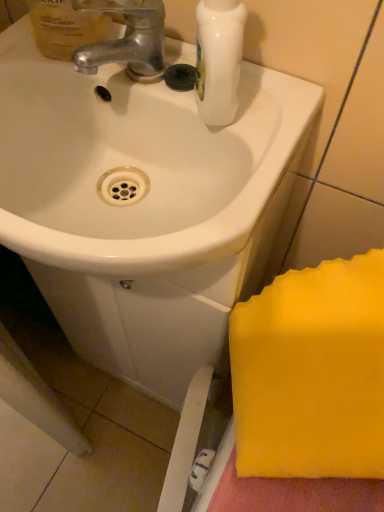
Question: Considering their positions, is silver metallic faucet at upper left located in front of or behind white glossy sink at center?

Choices:
 (A) front
 (B) behind

Answer: (B)

Question: Would you say silver metallic faucet at upper left is inside or outside white glossy sink at center?

Choices:
 (A) outside
 (B) inside

Answer: (A)

Question: Estimate the real-world distances between objects in this image. Which object is farther from the translucent plastic mouthwash at upper left?

Choices:
 (A) white glossy sink at center
 (B) silver metallic faucet at upper left

Answer: (A)

Question: Considering the real-world distances, which object is farthest from the silver metallic faucet at upper left?

Choices:
 (A) translucent plastic mouthwash at upper left
 (B) white glossy sink at center

Answer: (B)